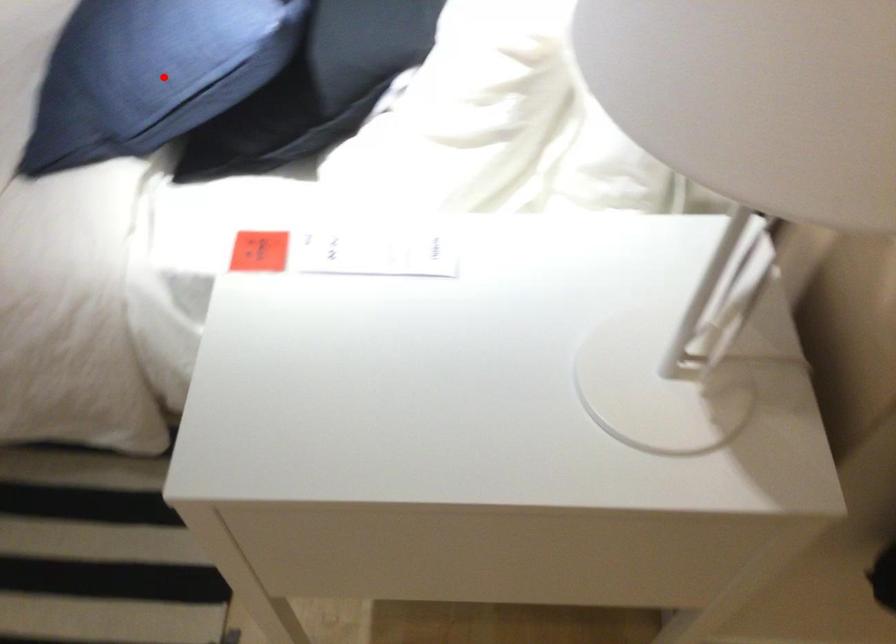
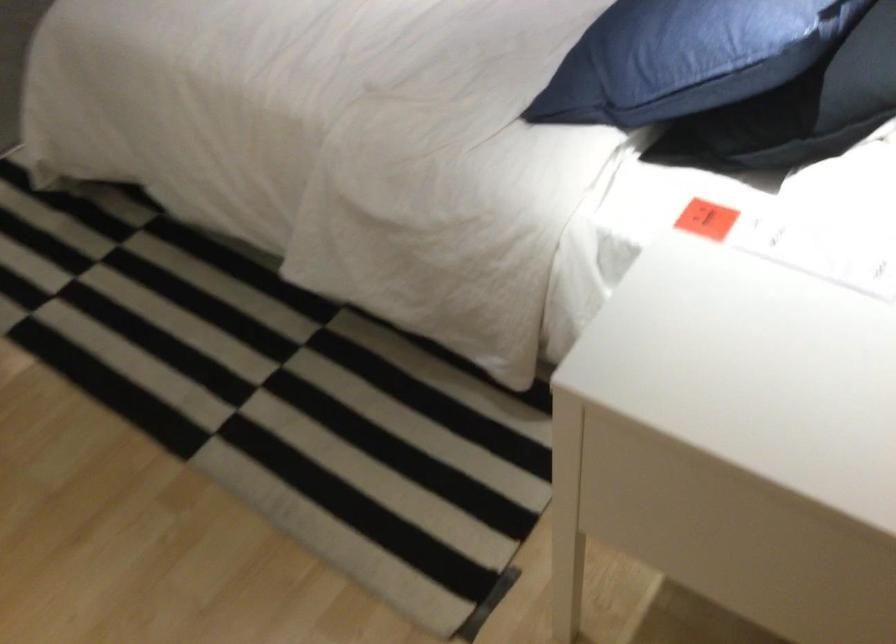
Locate, in the second image, the point that corresponds to the highlighted location in the first image.

(675, 58)